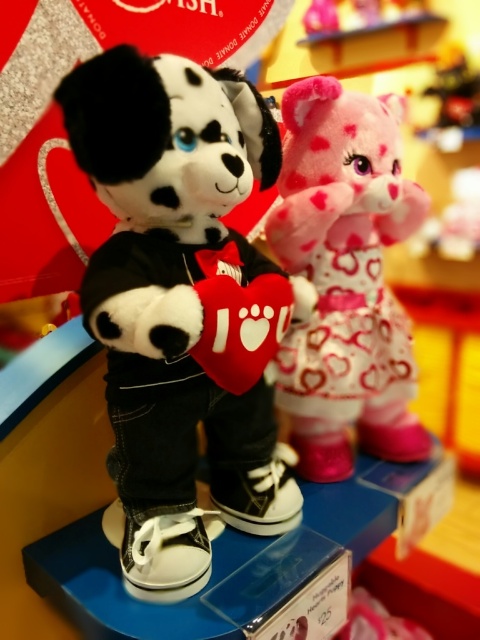
Question: Can you confirm if soft plush dog at center is positioned to the right of fluffy pink plush at upper right?

Choices:
 (A) no
 (B) yes

Answer: (A)

Question: Which of the following is the farthest from the observer?

Choices:
 (A) (168, 134)
 (B) (380, 250)

Answer: (B)

Question: Which object appears farthest from the camera in this image?

Choices:
 (A) soft plush dog at center
 (B) fluffy pink plush at upper right

Answer: (B)

Question: Can you confirm if soft plush dog at center is thinner than fluffy pink plush at upper right?

Choices:
 (A) yes
 (B) no

Answer: (B)

Question: Which point is farther to the camera?

Choices:
 (A) (289, 138)
 (B) (215, 484)

Answer: (A)

Question: Can you confirm if soft plush dog at center is positioned above fluffy pink plush at upper right?

Choices:
 (A) yes
 (B) no

Answer: (B)